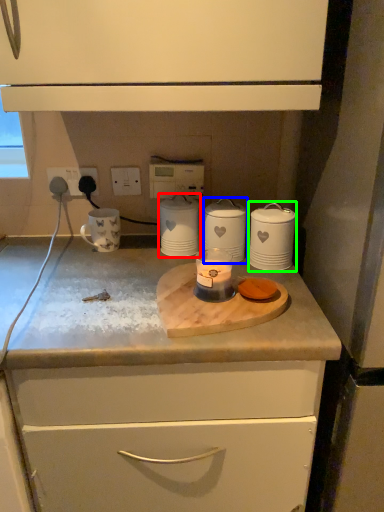
Question: Which is farther away from home appliance (highlighted by a red box)? home appliance (highlighted by a blue box) or home appliance (highlighted by a green box)?

Choices:
 (A) home appliance
 (B) home appliance

Answer: (B)